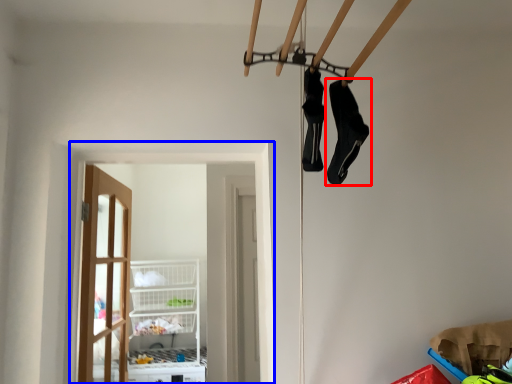
Question: Among these objects, which one is nearest to the camera, footwear (highlighted by a red box) or window (highlighted by a blue box)?

Choices:
 (A) footwear
 (B) window

Answer: (A)